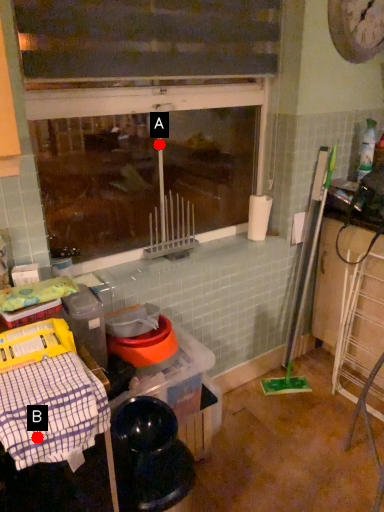
Question: Two points are circled on the image, labeled by A and B beside each circle. Which point appears farthest from the camera in this image?

Choices:
 (A) A is further
 (B) B is further

Answer: (A)